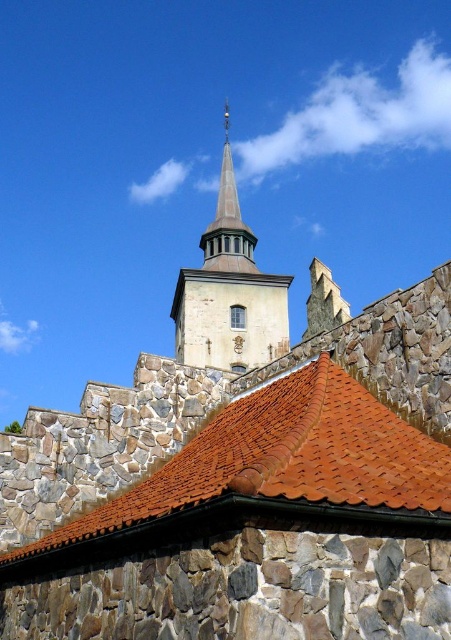
Question: Can you confirm if brown tile roof at center is positioned above smooth stone tower at center?

Choices:
 (A) no
 (B) yes

Answer: (A)

Question: Among these objects, which one is nearest to the camera?

Choices:
 (A) brown tile roof at center
 (B) smooth stone tower at center

Answer: (A)

Question: Is brown tile roof at center below smooth stone tower at center?

Choices:
 (A) yes
 (B) no

Answer: (A)

Question: Can you confirm if brown tile roof at center is wider than smooth stone tower at center?

Choices:
 (A) yes
 (B) no

Answer: (B)

Question: Which point is closer to the camera?

Choices:
 (A) (300, 442)
 (B) (211, 228)

Answer: (A)

Question: Which object appears closest to the camera in this image?

Choices:
 (A) smooth stone tower at center
 (B) brown tile roof at center

Answer: (B)